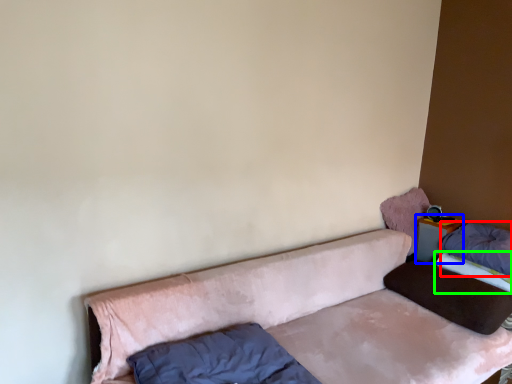
Question: Which object is the closest to the pillow (highlighted by a red box)? Choose among these: table (highlighted by a blue box) or mattress (highlighted by a green box).

Choices:
 (A) table
 (B) mattress

Answer: (B)